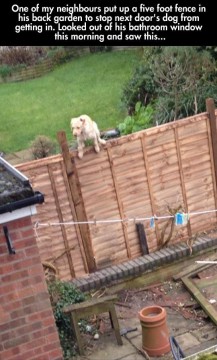
The width and height of the screenshot is (217, 360). What are the coordinates of `clay [pot` in the screenshot? It's located at (157, 343).